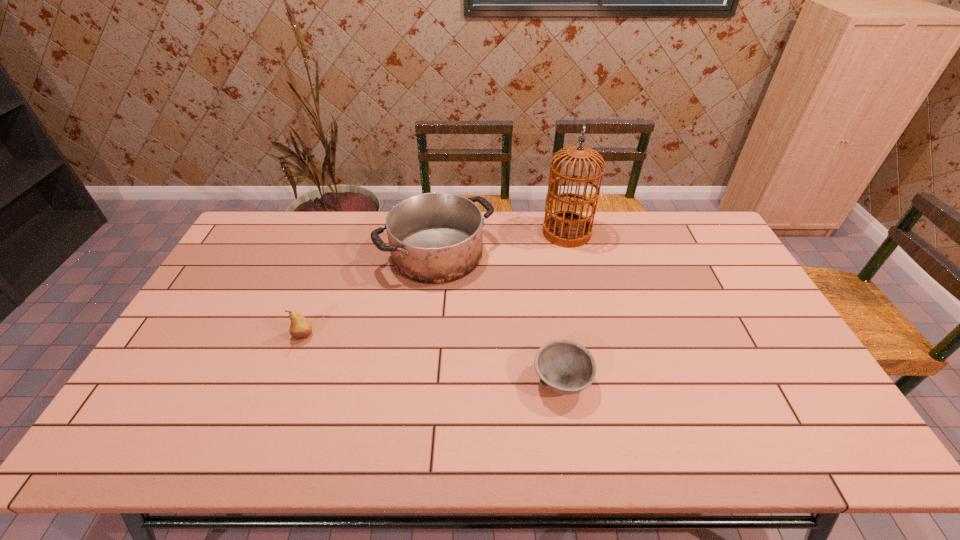
Find the location of a particular element. Image resolution: width=960 pixels, height=540 pixels. the tallest object is located at coordinates (569, 229).

Find the location of a particular element. the third object from right to left is located at coordinates pyautogui.click(x=434, y=238).

At what (x,y) coordinates should I click in order to perform the action: click on the leftmost object. Please return your answer as a coordinate pair (x, y). This screenshot has height=540, width=960. Looking at the image, I should click on (300, 328).

The image size is (960, 540). In order to click on pear in this screenshot , I will do `click(300, 328)`.

What are the coordinates of `the nearest object` in the screenshot? It's located at (566, 367).

Where is `the shortest object`? Image resolution: width=960 pixels, height=540 pixels. the shortest object is located at coordinates (566, 367).

Image resolution: width=960 pixels, height=540 pixels. In order to click on blank area located 0.370m on the left of the birdcage in this screenshot , I will do point(441,233).

You are a GUI agent. You are given a task and a screenshot of the screen. Output one action in this format:
    pyautogui.click(x=<x>, y=<y>)
    Task: Click on the free spot located on the right of the third object from right to left
    This screenshot has height=540, width=960.
    Given the screenshot: What is the action you would take?
    pyautogui.click(x=549, y=254)

Locate an element on the screen. Image resolution: width=960 pixels, height=540 pixels. free space located 0.060m on the front of the leftmost object is located at coordinates (294, 362).

Locate an element on the screen. Image resolution: width=960 pixels, height=540 pixels. free space located on the front of the nearest object is located at coordinates (573, 456).